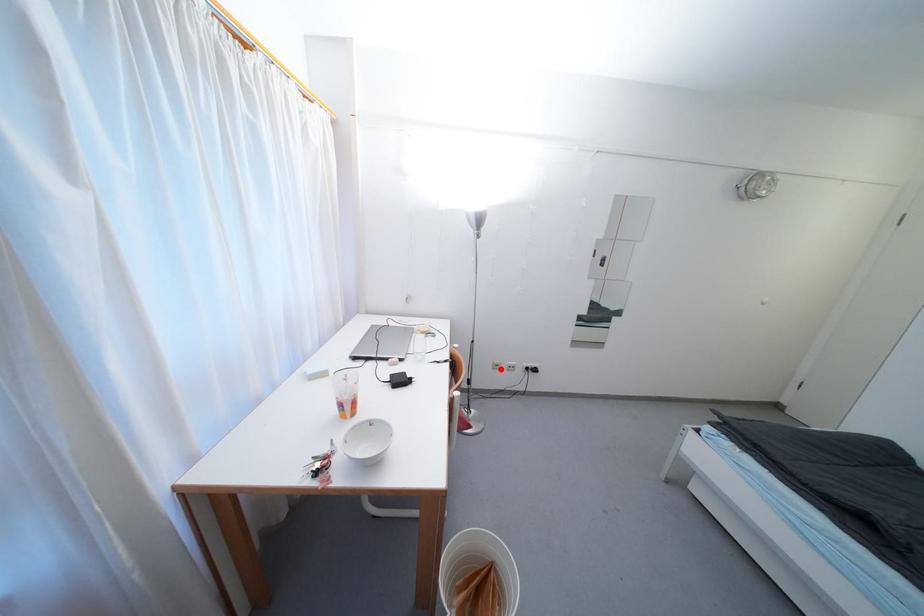
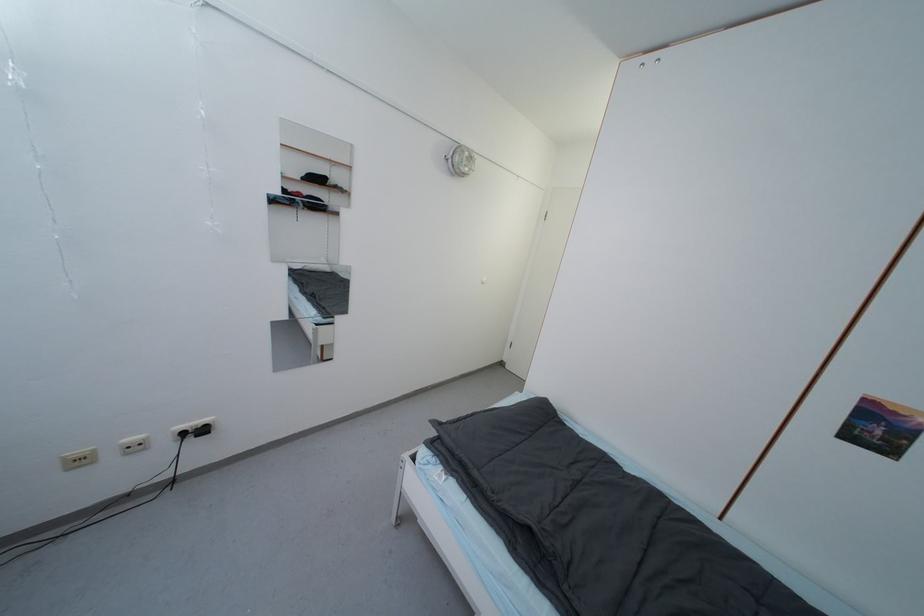
Question: I am providing you with two images of the same scene from different viewpoints. In image1, a red point is highlighted. Considering the same 3D point in image2, which of the following is correct?

Choices:
 (A) It is closer
 (B) It is farther

Answer: (A)